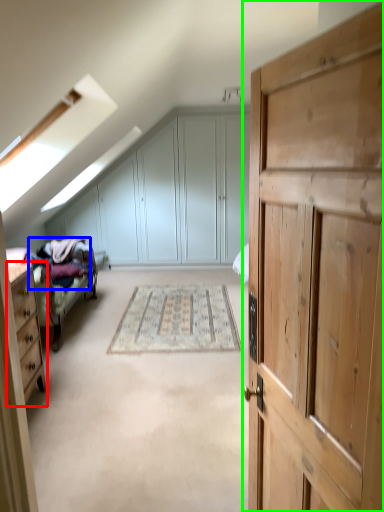
Question: Estimate the real-world distances between objects in this image. Which object is farther from chest of drawers (highlighted by a red box), bedding (highlighted by a blue box) or cupboard (highlighted by a green box)?

Choices:
 (A) bedding
 (B) cupboard

Answer: (B)